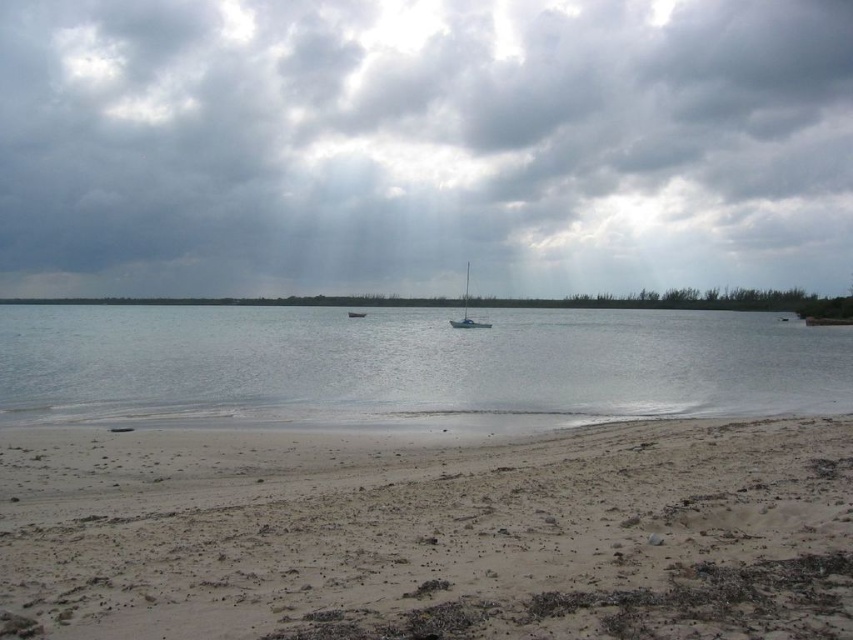
Question: Which object is farther from the camera taking this photo?

Choices:
 (A) light brown sandy beach at lower center
 (B) cloudy sky at upper center

Answer: (B)

Question: Considering the relative positions of cloudy sky at upper center and clear water at lower left in the image provided, where is cloudy sky at upper center located with respect to clear water at lower left?

Choices:
 (A) above
 (B) below

Answer: (A)

Question: Does clear water at lower left have a smaller size compared to white matte sailboat at center?

Choices:
 (A) no
 (B) yes

Answer: (A)

Question: Is cloudy sky at upper center above clear water at lower left?

Choices:
 (A) no
 (B) yes

Answer: (B)

Question: Among these points, which one is nearest to the camera?

Choices:
 (A) (10, 172)
 (B) (473, 321)
 (C) (160, 376)
 (D) (704, 532)

Answer: (D)

Question: Which of the following is the closest to the observer?

Choices:
 (A) (817, 36)
 (B) (165, 518)
 (C) (462, 312)

Answer: (B)